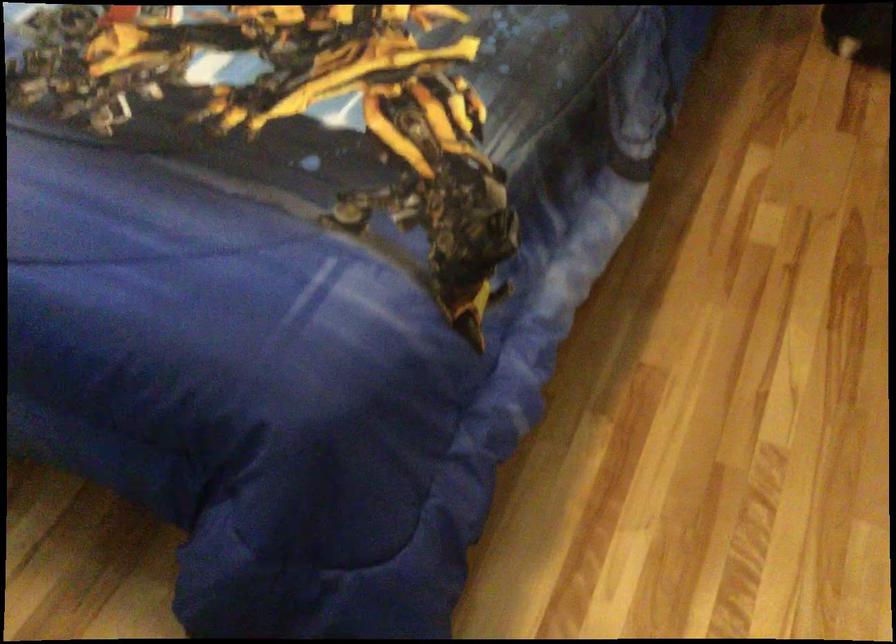
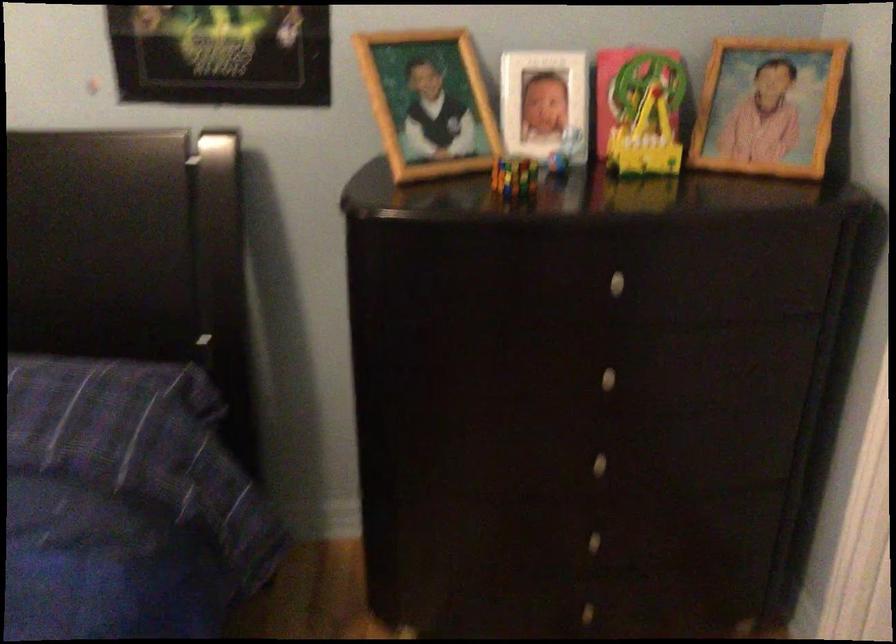
The images are taken continuously from a first-person perspective. In which direction is your viewpoint rotating?

The camera rotated toward right-up.